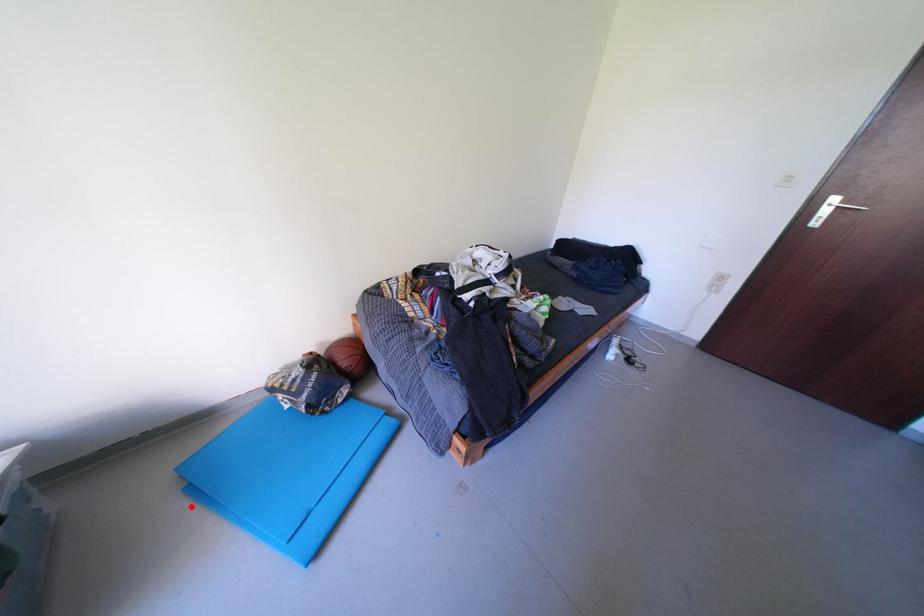
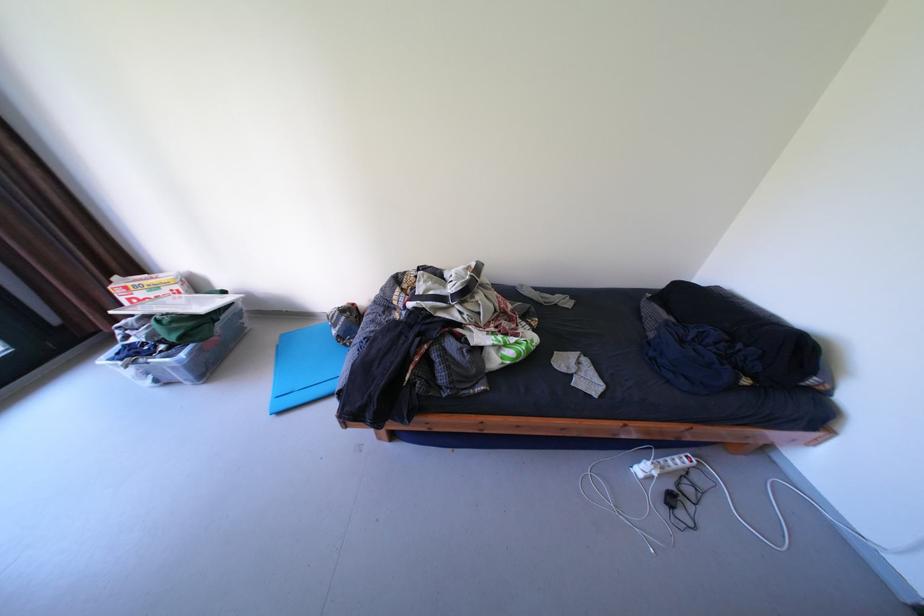
The point at the highlighted location is marked in the first image. Where is the corresponding point in the second image?

(283, 353)